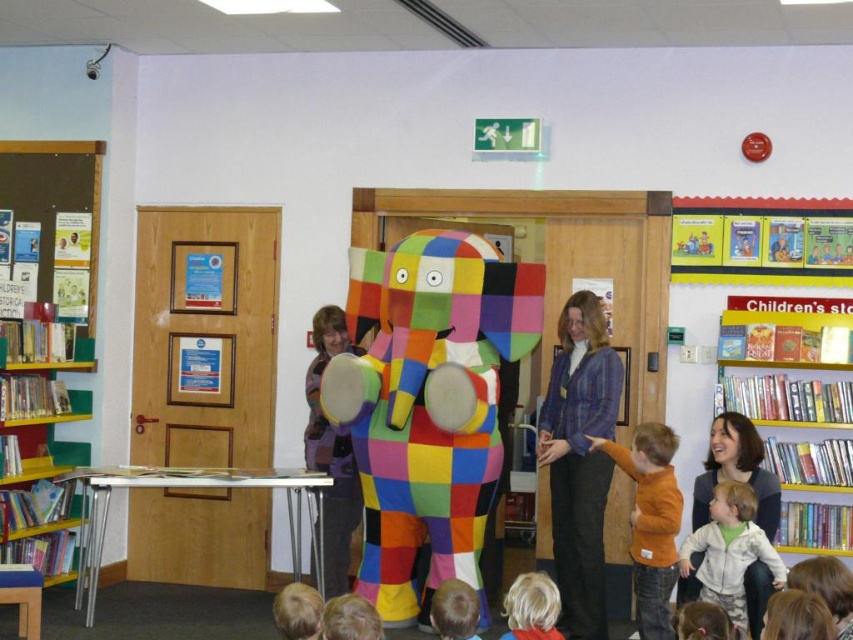
Between point (480, 276) and point (450, 602), which one is positioned behind?

The point (480, 276) is behind.

Between point (363, 548) and point (473, 592), which one is positioned behind?

The point (363, 548) is behind.

Find the location of a particular element. Image resolution: width=853 pixels, height=640 pixels. multicolored fabric elephant at center is located at coordinates (428, 403).

Consider the image. Can you confirm if multicolored plastic bookshelf at left is smaller than blue plaid jacket at center?

No, multicolored plastic bookshelf at left is not smaller than blue plaid jacket at center.

Is multicolored plastic bookshelf at left further to camera compared to blue plaid jacket at center?

Yes.

In order to click on multicolored plastic bookshelf at left in this screenshot , I will do `click(39, 436)`.

Is orange fleece sweater at lower center in front of smooth brown hair at lower center?

No.

Locate an element on the screen. orange fleece sweater at lower center is located at coordinates (650, 520).